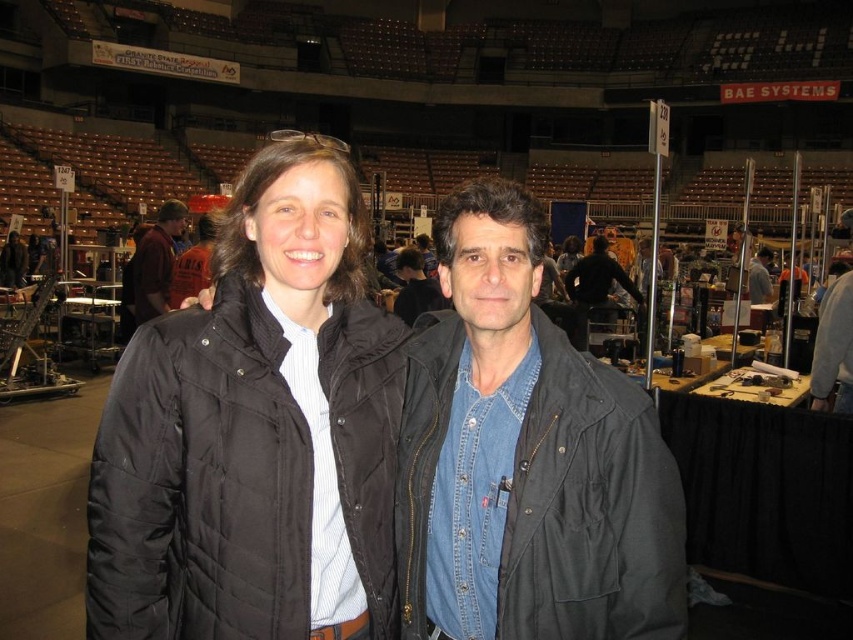
Is black quilted jacket at center wider than dark brown leather jacket at left?

Yes.

Can you confirm if black quilted jacket at center is positioned below dark brown leather jacket at left?

Correct, black quilted jacket at center is located below dark brown leather jacket at left.

Image resolution: width=853 pixels, height=640 pixels. What are the coordinates of `black quilted jacket at center` in the screenshot? It's located at (256, 432).

Which is behind, point (299, 358) or point (444, 349)?

The point (444, 349) is more distant.

Can you confirm if black quilted jacket at center is positioned to the left of denim shirt at center?

Yes, black quilted jacket at center is to the left of denim shirt at center.

Between point (114, 416) and point (439, 452), which one is positioned behind?

The point (439, 452) is more distant.

Where is `black quilted jacket at center`? black quilted jacket at center is located at coordinates (256, 432).

Image resolution: width=853 pixels, height=640 pixels. What do you see at coordinates (526, 458) in the screenshot? I see `denim shirt at center` at bounding box center [526, 458].

This screenshot has height=640, width=853. I want to click on denim shirt at center, so click(x=526, y=458).